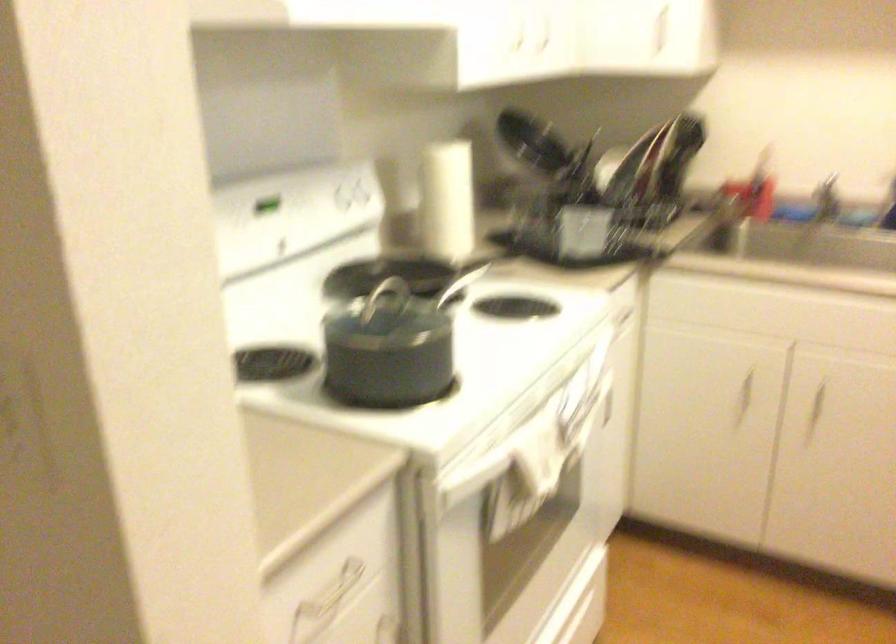
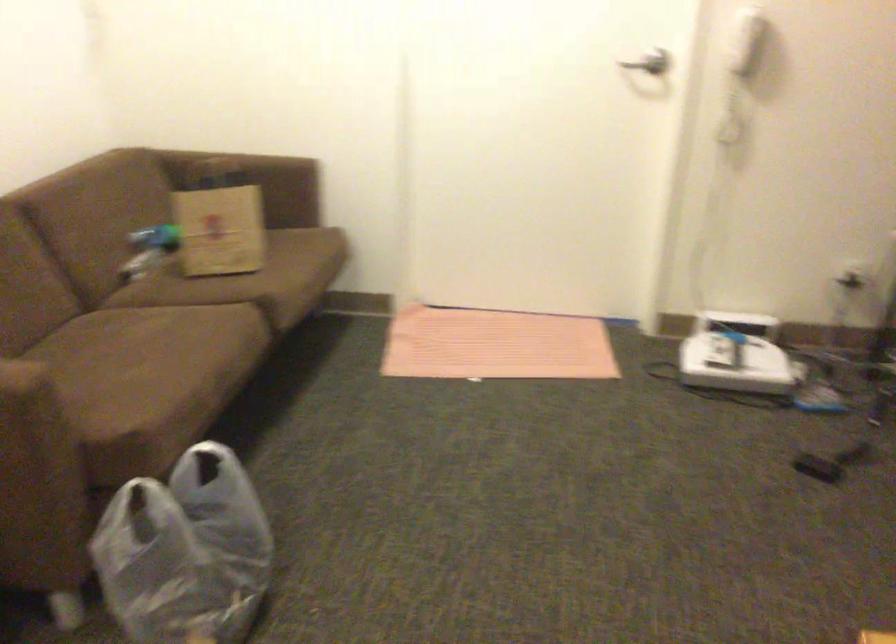
The images are taken continuously from a first-person perspective. In which direction is your viewpoint rotating?

The camera's rotation is toward right-down.